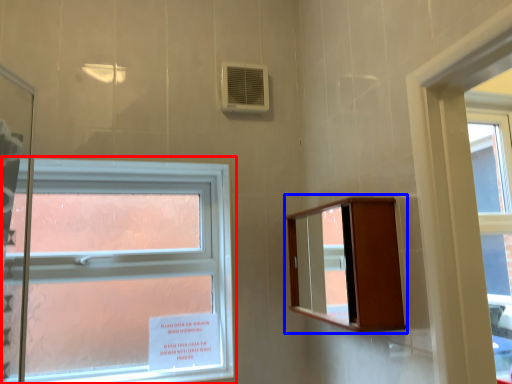
Question: Which object appears farthest to the camera in this image, window (highlighted by a red box) or medicine cabinet (highlighted by a blue box)?

Choices:
 (A) window
 (B) medicine cabinet

Answer: (A)